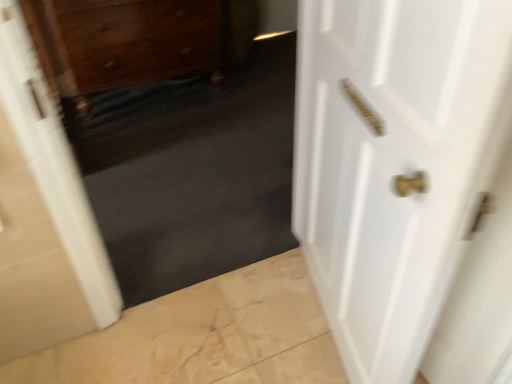
You are a GUI agent. You are given a task and a screenshot of the screen. Output one action in this format:
    pyautogui.click(x=<x>, y=<y>)
    Task: Click on the vacant space behind dark matte carpet at center
    This screenshot has height=384, width=512.
    Given the screenshot: What is the action you would take?
    pyautogui.click(x=219, y=206)